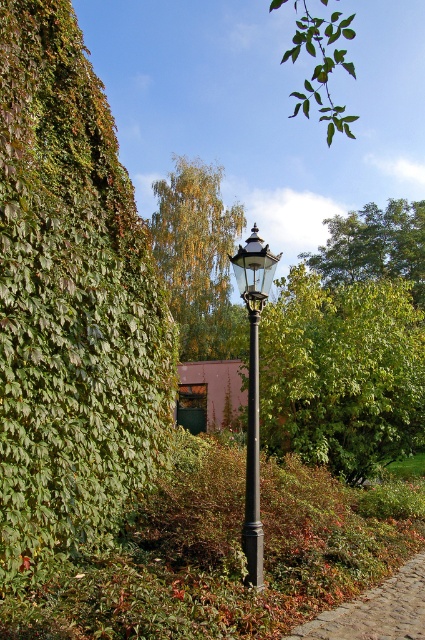
You are a maintenance worker who needs to replace the bulb in the black metal street light at center. There is a ladder leaning against the black polished pole at center. Can you safely reach the bulb using the ladder from the pole?

The black metal street light at center and black polished pole at center are 20.03 inches apart. Since the ladder is leaning against the black polished pole at center, the distance between the pole and the street light is too small for the ladder to safely reach the bulb. You would need to move the ladder closer to the street light itself.

You are a bird looking for a place to perch. You see a green leafy tree at upper center and a black metal street light at center. Which one is taller?

The green leafy tree at upper center is much taller than the black metal street light at center, so the bird should choose the green leafy tree at upper center for perching.